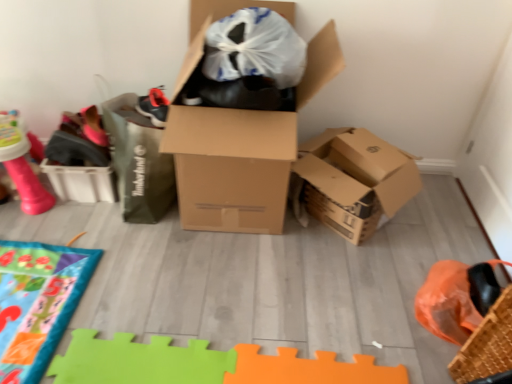
Question: From a real-world perspective, relative to brown cardboard box at center, is woven brown basket at lower right vertically above or below?

Choices:
 (A) above
 (B) below

Answer: (B)

Question: From the image's perspective, relative to brown cardboard box at center, is woven brown basket at lower right above or below?

Choices:
 (A) below
 (B) above

Answer: (A)

Question: Considering the real-world distances, which object is farthest from the pink rubber toy at upper left?

Choices:
 (A) brown cardboard box at center
 (B) woven brown basket at lower right

Answer: (B)

Question: Which of these objects is positioned closest to the pink rubber toy at upper left?

Choices:
 (A) woven brown basket at lower right
 (B) brown cardboard box at center

Answer: (B)